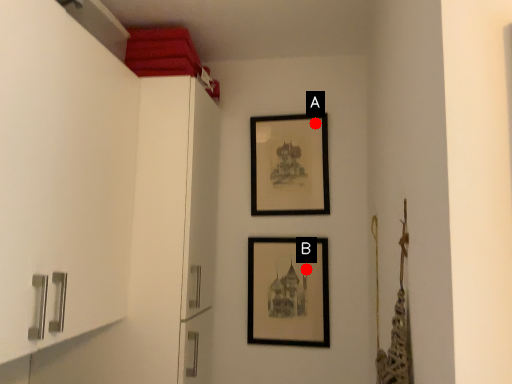
Question: Two points are circled on the image, labeled by A and B beside each circle. Which point is closer to the camera?

Choices:
 (A) A is closer
 (B) B is closer

Answer: (B)